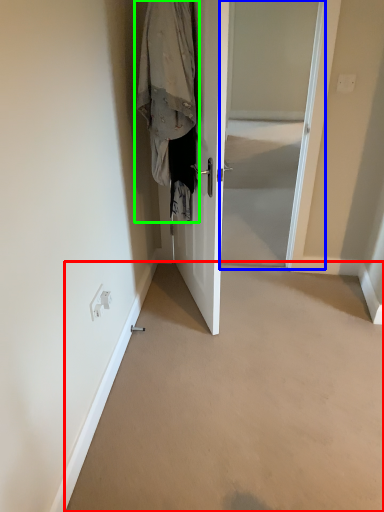
Question: Which object is the closest to the corridor (highlighted by a red box)? Choose among these: screen door (highlighted by a blue box) or clothing (highlighted by a green box).

Choices:
 (A) screen door
 (B) clothing

Answer: (B)